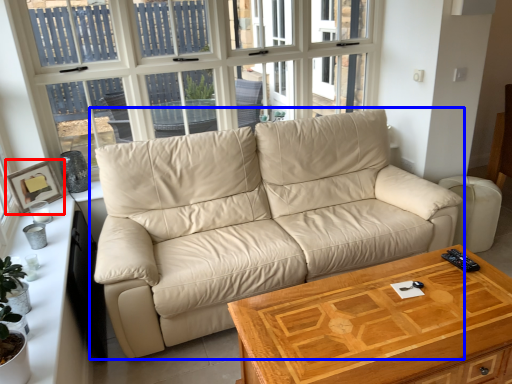
Question: Which of the following is the closest to the observer, picture frame (highlighted by a red box) or studio couch (highlighted by a blue box)?

Choices:
 (A) picture frame
 (B) studio couch

Answer: (B)